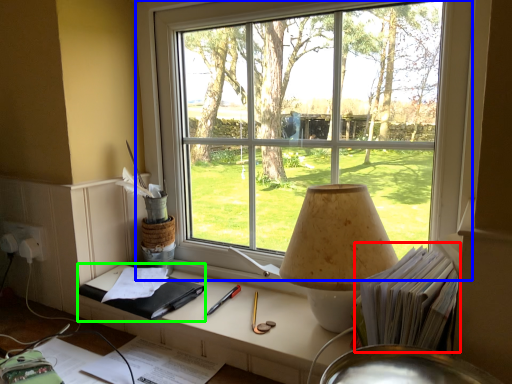
Question: Which is farther away from book (highlighted by a red box)? window (highlighted by a blue box) or notebook (highlighted by a green box)?

Choices:
 (A) window
 (B) notebook

Answer: (B)